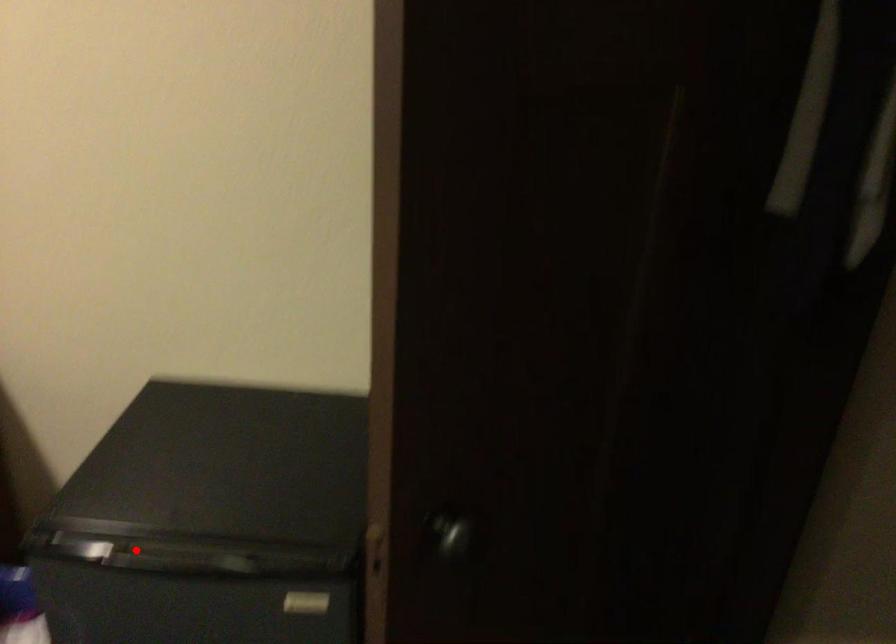
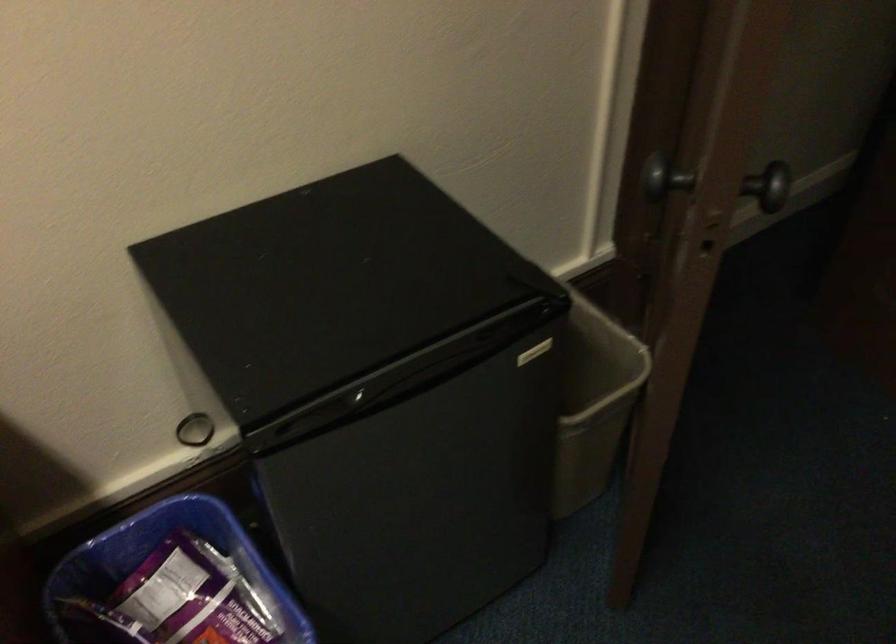
Question: I am providing you with two images of the same scene from different viewpoints. In image1, a red point is highlighted. Considering the same 3D point in image2, which of the following is correct?

Choices:
 (A) It is closer
 (B) It is farther

Answer: (A)